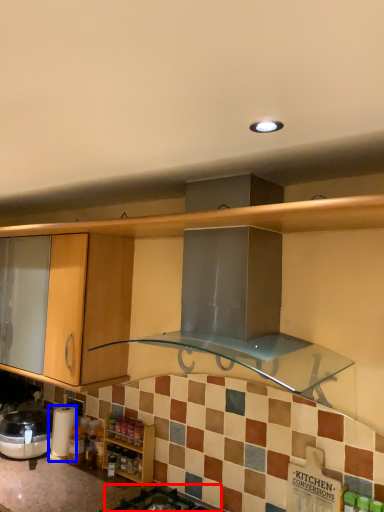
Question: Which of the following is the closest to the observer, gas stove (highlighted by a red box) or appliance (highlighted by a blue box)?

Choices:
 (A) gas stove
 (B) appliance

Answer: (A)